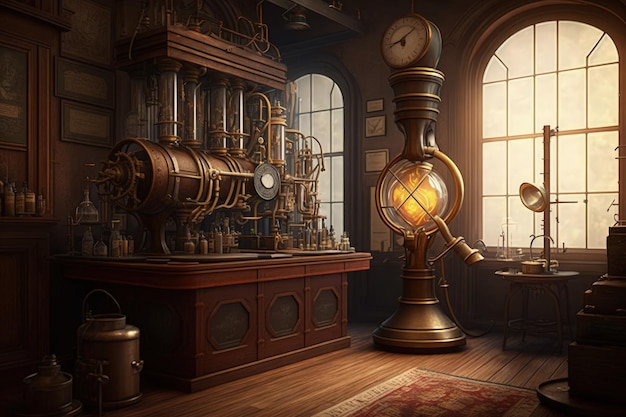
This screenshot has width=626, height=417. Find the location of `wood floor`. wood floor is located at coordinates (331, 380).